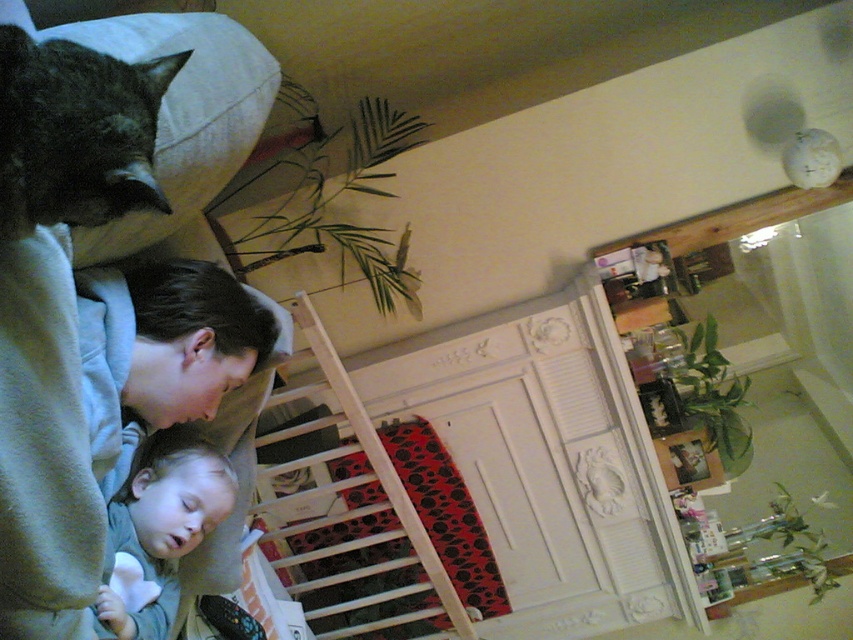
Is gray fur cat at upper left thinner than soft gray fabric at lower left?

No, gray fur cat at upper left is not thinner than soft gray fabric at lower left.

Is point (136, 161) positioned in front of point (119, 609)?

Yes, point (136, 161) is in front of point (119, 609).

Find the location of `gray fur cat at upper left`. gray fur cat at upper left is located at coordinates (76, 132).

Find the location of a particular element. Image resolution: width=853 pixels, height=640 pixels. gray fur cat at upper left is located at coordinates (76, 132).